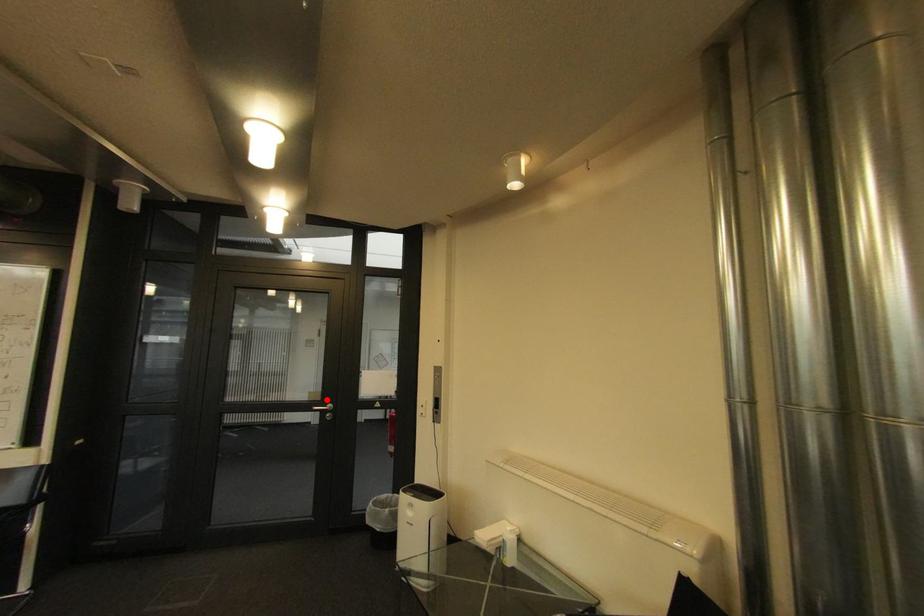
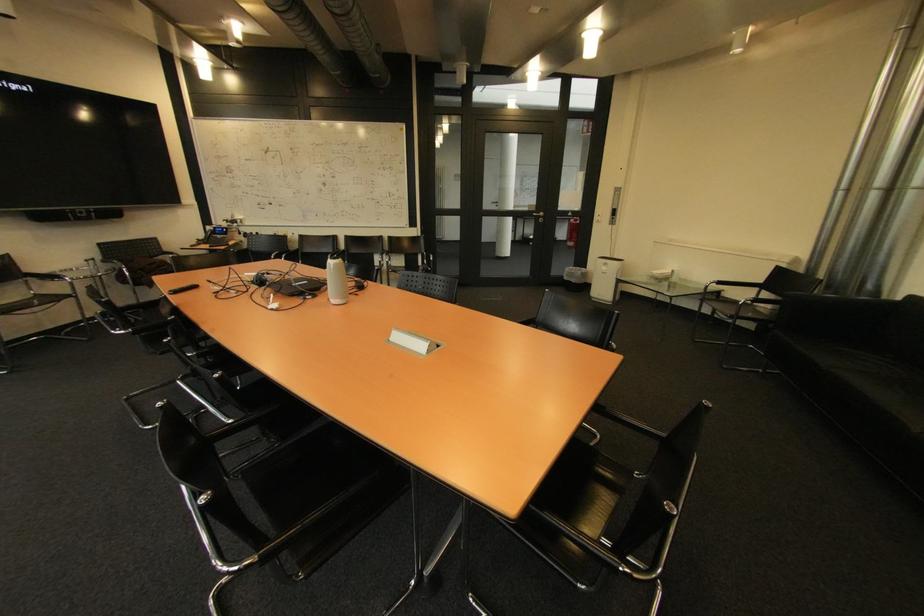
Question: A red point is marked in image1. In image2, is the corresponding 3D point closer to the camera or farther? Reply with the corresponding letter.

Choices:
 (A) The corresponding 3D point is closer.
 (B) The corresponding 3D point is farther.

Answer: (A)